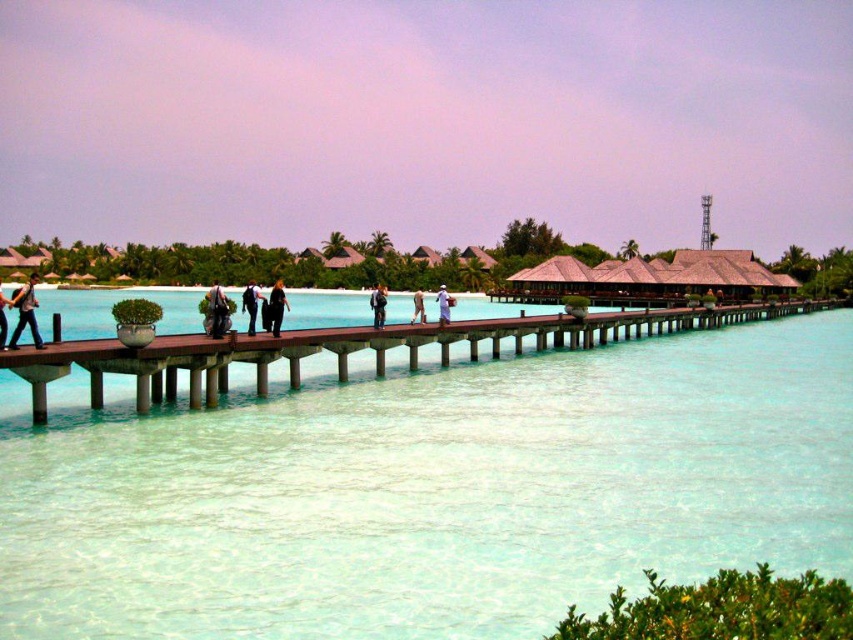
Question: Which of the following is the closest to the observer?

Choices:
 (A) (213, 324)
 (B) (274, 470)
 (C) (444, 289)

Answer: (B)

Question: Can you confirm if clear water at center is thinner than dark blue fabric shirt at center?

Choices:
 (A) no
 (B) yes

Answer: (A)

Question: Which of the following is the farthest from the observer?

Choices:
 (A) dark blue fabric bag at center
 (B) white fabric shirt at center
 (C) dark blue fabric shirt at center

Answer: (B)

Question: Which object appears farthest from the camera in this image?

Choices:
 (A) wooden pier at center
 (B) matte black pants at left
 (C) clear water at center

Answer: (B)

Question: Can you confirm if clear water at center is positioned to the right of wooden pier at center?

Choices:
 (A) no
 (B) yes

Answer: (A)

Question: Does clear water at center appear on the left side of white cotton shirt at center?

Choices:
 (A) yes
 (B) no

Answer: (B)